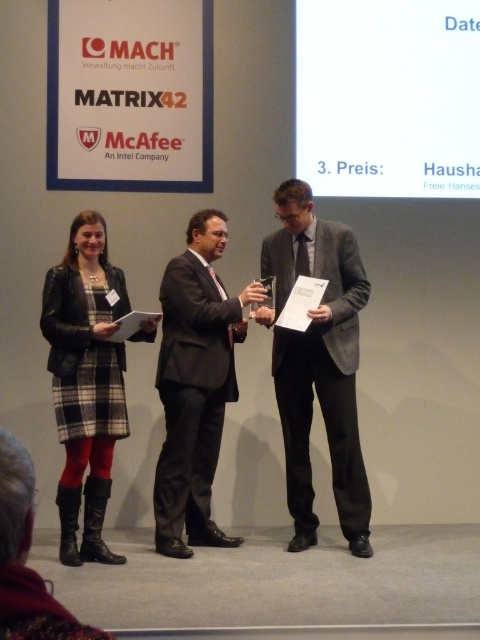
Question: Can you confirm if black suit at center is positioned above plaid fabric dress at left?

Choices:
 (A) no
 (B) yes

Answer: (B)

Question: Which object is the farthest from the black suit at center?

Choices:
 (A) plaid fabric dress at left
 (B) gray suit at center

Answer: (B)

Question: Which of the following is the farthest from the observer?

Choices:
 (A) (292, 472)
 (B) (54, 280)
 (C) (168, 454)

Answer: (A)

Question: Among these objects, which one is nearest to the camera?

Choices:
 (A) gray suit at center
 (B) black suit at center

Answer: (B)

Question: Is gray suit at center wider than black suit at center?

Choices:
 (A) no
 (B) yes

Answer: (B)

Question: Is black suit at center below plaid fabric dress at left?

Choices:
 (A) yes
 (B) no

Answer: (B)